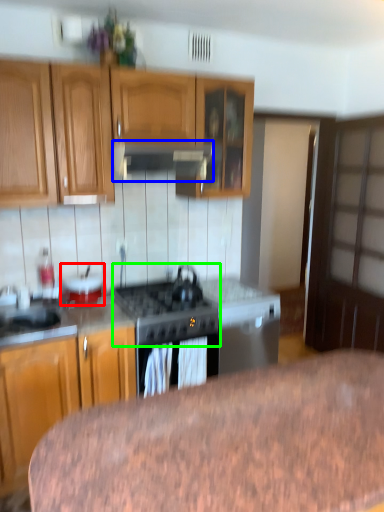
Question: Based on their relative distances, which object is nearer to appliance (highlighted by a red box)? Choose from exhaust hood (highlighted by a blue box) and gas stove (highlighted by a green box).

Choices:
 (A) exhaust hood
 (B) gas stove

Answer: (B)